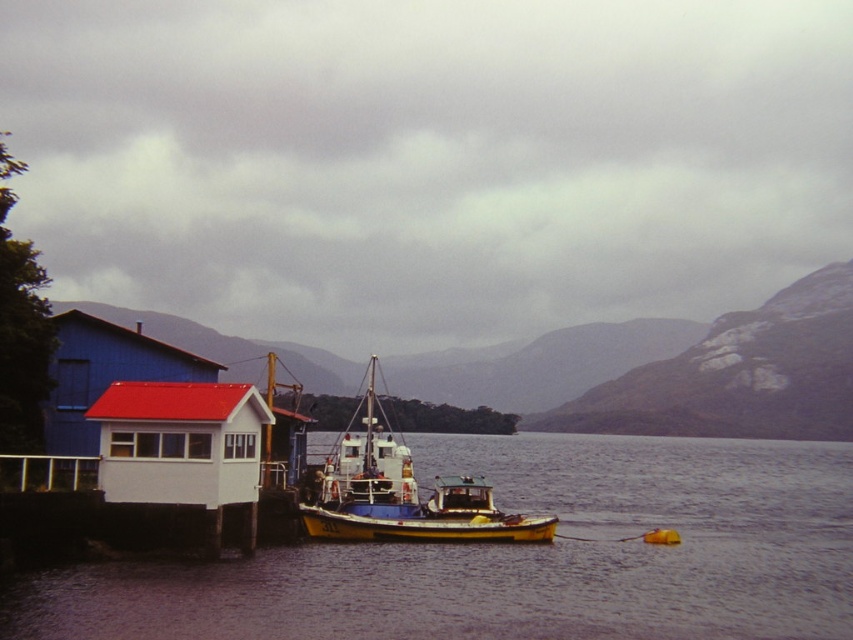
Can you confirm if smooth water at center is positioned to the right of white matte building at left?

Indeed, smooth water at center is positioned on the right side of white matte building at left.

Identify the location of smooth water at center. The height and width of the screenshot is (640, 853). (521, 557).

Between smooth water at center and yellow matte boat at center, which one appears on the left side from the viewer's perspective?

From the viewer's perspective, yellow matte boat at center appears more on the left side.

Is point (573, 496) closer to viewer compared to point (370, 524)?

No, it is behind (370, 524).

Locate an element on the screen. This screenshot has height=640, width=853. smooth water at center is located at coordinates (521, 557).

Can you confirm if white matte building at left is thinner than yellow matte boat at center?

Incorrect, white matte building at left's width is not less than yellow matte boat at center's.

Can you confirm if white matte building at left is shorter than yellow matte boat at center?

In fact, white matte building at left may be taller than yellow matte boat at center.

Between point (807, 288) and point (419, 522), which one is positioned in front?

Point (419, 522)

Image resolution: width=853 pixels, height=640 pixels. Find the location of `white matte building at left`. white matte building at left is located at coordinates (672, 371).